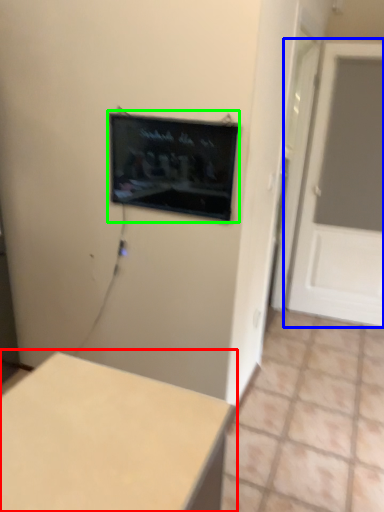
Question: Considering the real-world distances, which object is farthest from table (highlighted by a red box)? door (highlighted by a blue box) or computer screen (highlighted by a green box)?

Choices:
 (A) door
 (B) computer screen

Answer: (A)